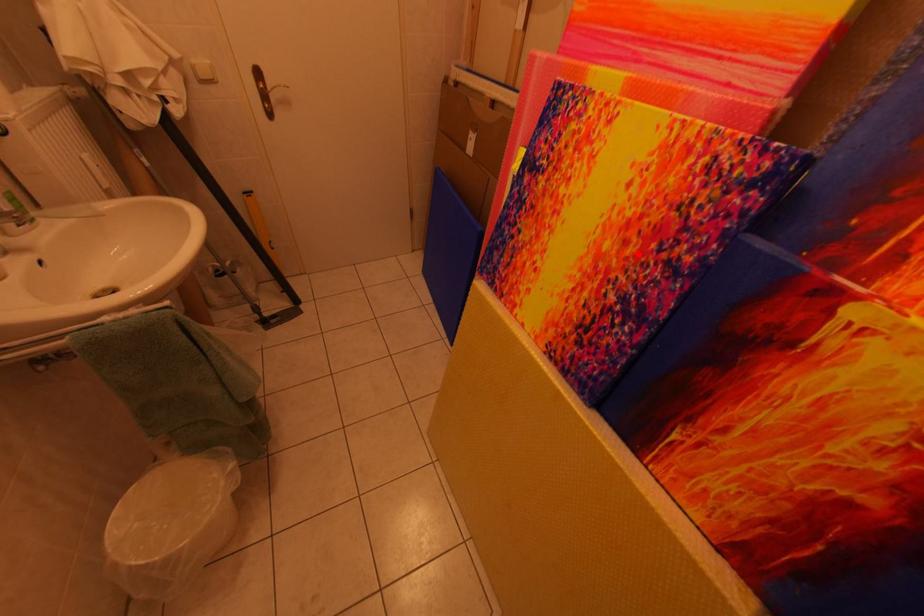
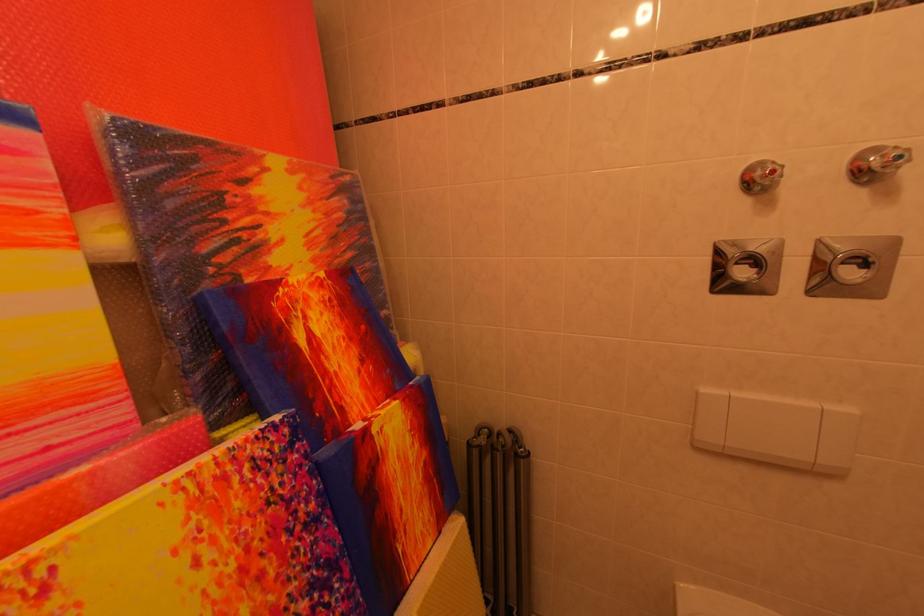
In the second image, find the point that corresponds to the highlighted location in the first image.

(281, 575)